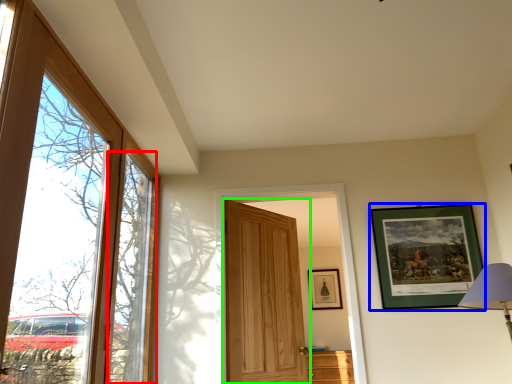
Question: Considering the real-world distances, which object is closest to window (highlighted by a red box)? picture frame (highlighted by a blue box) or door (highlighted by a green box).

Choices:
 (A) picture frame
 (B) door

Answer: (B)